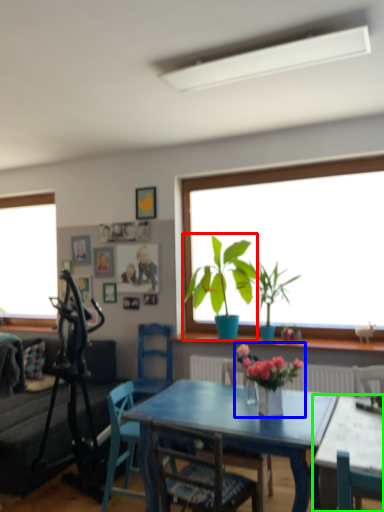
Question: Considering the real-world distances, which object is farthest from houseplant (highlighted by a red box)? floral arrangement (highlighted by a blue box) or table (highlighted by a green box)?

Choices:
 (A) floral arrangement
 (B) table

Answer: (B)